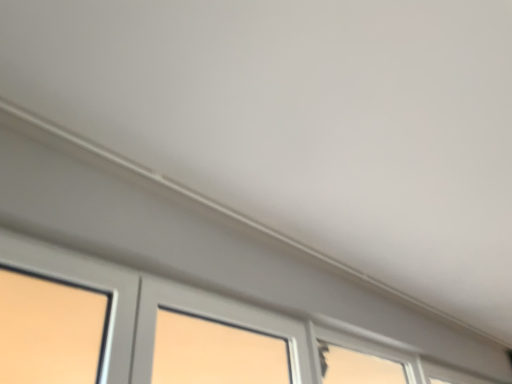
Where is `matte gray window at lower left, the 1th window in the front-to-back sequence`? The image size is (512, 384). matte gray window at lower left, the 1th window in the front-to-back sequence is located at coordinates (212, 314).

In order to face transparent glass window at lower right, which ranks as the second window in back-to-front order, should I rotate leftwards or rightwards?

You should rotate right by 15.874 degrees.

Identify the location of clear glass window at lower right, which ranks as the first window in back-to-front order. This screenshot has width=512, height=384. (450, 375).

Would you say transparent glass window at lower right, arranged as the second window when viewed from the right, is to the left or to the right of clear glass window at lower right, arranged as the 1th window when viewed from the right, in the picture?

Clearly, transparent glass window at lower right, arranged as the second window when viewed from the right, is on the left of clear glass window at lower right, arranged as the 1th window when viewed from the right, in the image.

Is transparent glass window at lower right, arranged as the second window when viewed from the right, touching clear glass window at lower right, which ranks as the first window in back-to-front order?

transparent glass window at lower right, arranged as the second window when viewed from the right, and clear glass window at lower right, which ranks as the first window in back-to-front order, are clearly separated.

Which of these two, transparent glass window at lower right, which ranks as the second window in back-to-front order, or clear glass window at lower right, arranged as the 1th window when viewed from the right, stands taller?

transparent glass window at lower right, which ranks as the second window in back-to-front order, is taller.

From a real-world perspective, does transparent glass window at lower right, placed as the 2th window when sorted from front to back, stand above clear glass window at lower right, which ranks as the first window in back-to-front order?

Incorrect, from a real-world perspective, transparent glass window at lower right, placed as the 2th window when sorted from front to back, is lower than clear glass window at lower right, which ranks as the first window in back-to-front order.

Where is `the 1st window below the matte gray window at lower left, placed as the first window when sorted from left to right (from the image's perspective)`? The height and width of the screenshot is (384, 512). the 1st window below the matte gray window at lower left, placed as the first window when sorted from left to right (from the image's perspective) is located at coordinates (360, 362).

Which is in front, point (364, 367) or point (155, 282)?

The point (155, 282) is closer.

Does transparent glass window at lower right, placed as the 2th window when sorted from front to back, have a lesser height compared to matte gray window at lower left, the third window from the back?

Correct, transparent glass window at lower right, placed as the 2th window when sorted from front to back, is not as tall as matte gray window at lower left, the third window from the back.

You are a GUI agent. You are given a task and a screenshot of the screen. Output one action in this format:
    pyautogui.click(x=<x>, y=<y>)
    Task: Click on the window below the transparent glass window at lower right, the second window viewed from the left (from the image's perspective)
    The image size is (512, 384).
    Given the screenshot: What is the action you would take?
    pyautogui.click(x=450, y=375)

Does point (510, 379) come farther from viewer compared to point (403, 373)?

No, it is not.

Which object is positioned more to the right, clear glass window at lower right, marked as the 3th window in a front-to-back arrangement, or transparent glass window at lower right, arranged as the second window when viewed from the right?

clear glass window at lower right, marked as the 3th window in a front-to-back arrangement.

Between matte gray window at lower left, the 3th window viewed from the right, and clear glass window at lower right, arranged as the 1th window when viewed from the right, which one has less height?

clear glass window at lower right, arranged as the 1th window when viewed from the right, is shorter.

Which object is wider, matte gray window at lower left, placed as the first window when sorted from left to right, or clear glass window at lower right, which ranks as the first window in back-to-front order?

matte gray window at lower left, placed as the first window when sorted from left to right, is wider.

Can clear glass window at lower right, the third window from the left, be found inside matte gray window at lower left, the third window from the back?

No, clear glass window at lower right, the third window from the left, is located outside of matte gray window at lower left, the third window from the back.

Does matte gray window at lower left, placed as the first window when sorted from left to right, turn towards clear glass window at lower right, the third window from the left?

No, matte gray window at lower left, placed as the first window when sorted from left to right, is not aimed at clear glass window at lower right, the third window from the left.

Is clear glass window at lower right, which ranks as the first window in back-to-front order, positioned before matte gray window at lower left, the third window from the back?

No, clear glass window at lower right, which ranks as the first window in back-to-front order, is further to the viewer.

Considering the relative positions of clear glass window at lower right, the third window from the left, and matte gray window at lower left, the third window from the back, in the image provided, is clear glass window at lower right, the third window from the left, to the left of matte gray window at lower left, the third window from the back, from the viewer's perspective?

No, clear glass window at lower right, the third window from the left, is not to the left of matte gray window at lower left, the third window from the back.

Based on the photo, measure the distance between clear glass window at lower right, the third window from the left, and matte gray window at lower left, the 1th window in the front-to-back sequence.

clear glass window at lower right, the third window from the left, is 36.66 inches from matte gray window at lower left, the 1th window in the front-to-back sequence.

Is clear glass window at lower right, arranged as the 1th window when viewed from the right, oriented away from matte gray window at lower left, placed as the first window when sorted from left to right?

No, clear glass window at lower right, arranged as the 1th window when viewed from the right, is not facing away from matte gray window at lower left, placed as the first window when sorted from left to right.

From a real-world perspective, is matte gray window at lower left, the 3th window viewed from the right, physically located above or below transparent glass window at lower right, placed as the 2th window when sorted from front to back?

matte gray window at lower left, the 3th window viewed from the right, is below transparent glass window at lower right, placed as the 2th window when sorted from front to back.

Is matte gray window at lower left, placed as the first window when sorted from left to right, oriented towards transparent glass window at lower right, which ranks as the second window in back-to-front order?

No.

Based on the photo, which is correct: matte gray window at lower left, placed as the first window when sorted from left to right, is inside transparent glass window at lower right, placed as the 2th window when sorted from front to back, or outside of it?

matte gray window at lower left, placed as the first window when sorted from left to right, is not inside transparent glass window at lower right, placed as the 2th window when sorted from front to back, it's outside.

Consider the image. How distant is matte gray window at lower left, the third window from the back, from transparent glass window at lower right, which ranks as the second window in back-to-front order?

matte gray window at lower left, the third window from the back, is 6.56 feet from transparent glass window at lower right, which ranks as the second window in back-to-front order.

At what (x,y) coordinates should I click in order to perform the action: click on window located behind the transparent glass window at lower right, placed as the 2th window when sorted from front to back. Please return your answer as a coordinate pair (x, y). Looking at the image, I should click on (450, 375).

There is a matte gray window at lower left, the third window from the back. Where is `the 1st window above it (from a real-world perspective)`? The height and width of the screenshot is (384, 512). the 1st window above it (from a real-world perspective) is located at coordinates (360, 362).

From the picture: When comparing their distances from transparent glass window at lower right, which ranks as the second window in back-to-front order, does matte gray window at lower left, the 1th window in the front-to-back sequence, or clear glass window at lower right, arranged as the 1th window when viewed from the right, seem further?

Based on the image, matte gray window at lower left, the 1th window in the front-to-back sequence, appears to be further to transparent glass window at lower right, which ranks as the second window in back-to-front order.

Considering their positions, is matte gray window at lower left, placed as the first window when sorted from left to right, positioned further to clear glass window at lower right, marked as the 3th window in a front-to-back arrangement, than transparent glass window at lower right, the second window viewed from the left?

transparent glass window at lower right, the second window viewed from the left, is positioned further to the anchor clear glass window at lower right, marked as the 3th window in a front-to-back arrangement.

Looking at this image, when comparing their distances from transparent glass window at lower right, arranged as the second window when viewed from the right, does clear glass window at lower right, the third window from the left, or matte gray window at lower left, the 3th window viewed from the right, seem further?

Among the two, matte gray window at lower left, the 3th window viewed from the right, is located further to transparent glass window at lower right, arranged as the second window when viewed from the right.

Estimate the real-world distances between objects in this image. Which object is closer to matte gray window at lower left, the 3th window viewed from the right, transparent glass window at lower right, the second window viewed from the left, or clear glass window at lower right, the third window from the left?

clear glass window at lower right, the third window from the left.

Looking at the image, which one is located further to clear glass window at lower right, the third window from the left, transparent glass window at lower right, which ranks as the second window in back-to-front order, or matte gray window at lower left, the 1th window in the front-to-back sequence?

Among the two, transparent glass window at lower right, which ranks as the second window in back-to-front order, is located further to clear glass window at lower right, the third window from the left.

Based on the photo, looking at the image, which one is located closer to matte gray window at lower left, placed as the first window when sorted from left to right, clear glass window at lower right, marked as the 3th window in a front-to-back arrangement, or transparent glass window at lower right, placed as the 2th window when sorted from front to back?

Among the two, clear glass window at lower right, marked as the 3th window in a front-to-back arrangement, is located nearer to matte gray window at lower left, placed as the first window when sorted from left to right.

At what (x,y) coordinates should I click in order to perform the action: click on window between matte gray window at lower left, placed as the first window when sorted from left to right, and clear glass window at lower right, the third window from the left, in the horizontal direction. Please return your answer as a coordinate pair (x, y). This screenshot has height=384, width=512. Looking at the image, I should click on (360, 362).